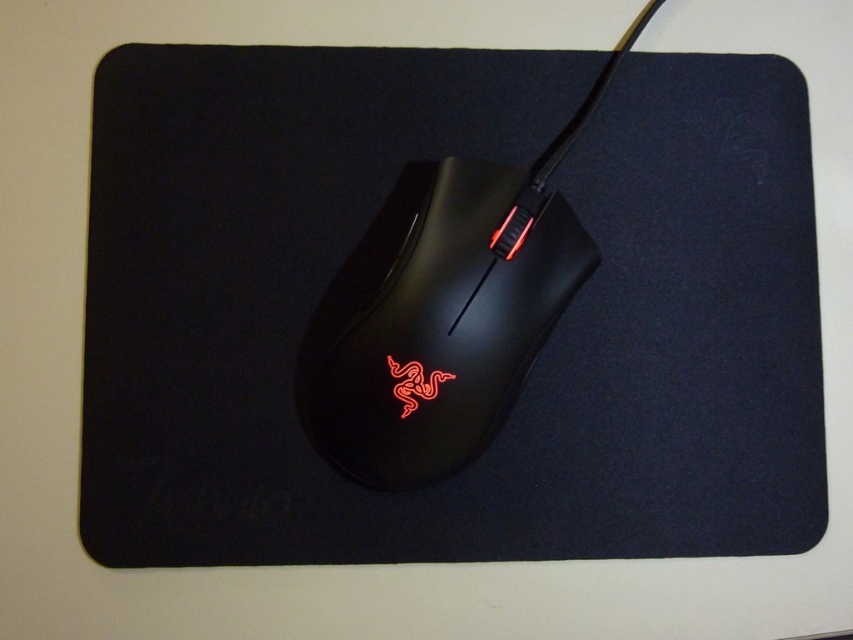
You are setting up a new gaming setup and want to ensure proper placement. Given the scene, which object, the black matte mousepad at center or the matte black mouse at center, has a greater height?

The black matte mousepad at center is taller than the matte black mouse at center.

You are setting up your new gaming setup and want to ensure there is enough space between your black matte mousepad at center and matte black mouse at center for your wrist to move comfortably. The recommended minimum distance between the mouse and mousepad should be at least 10 centimeters. Based on the image, does the current spacing meet this requirement?

The black matte mousepad at center is 11.34 centimeters from the matte black mouse at center, which exceeds the recommended minimum distance of 10 centimeters. Therefore, the current spacing meets the requirement.